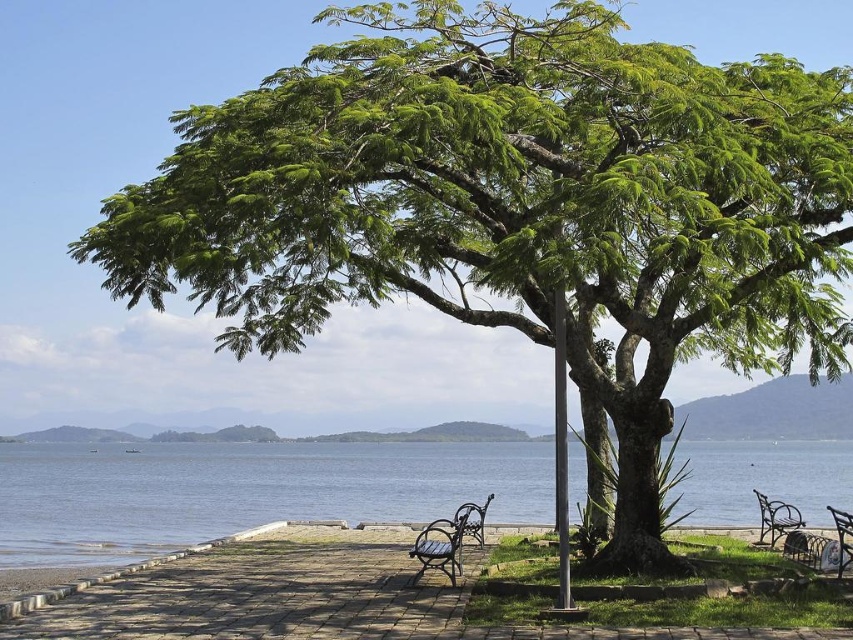
Is point (358, 492) farther from camera compared to point (461, 554)?

Yes.

Does blue water at lower center appear on the right side of bronze textured bench at center?

No, blue water at lower center is not to the right of bronze textured bench at center.

I want to click on blue water at lower center, so click(245, 492).

Find the location of a particular element. The width and height of the screenshot is (853, 640). blue water at lower center is located at coordinates (245, 492).

Between point (780, 516) and point (842, 513), which one is positioned in front?

Point (842, 513) is more forward.

The image size is (853, 640). Describe the element at coordinates (776, 518) in the screenshot. I see `brown wooden bench at lower right` at that location.

Locate an element on the screen. This screenshot has height=640, width=853. brown wooden bench at lower right is located at coordinates (776, 518).

Which is in front, point (200, 515) or point (764, 513)?

Point (764, 513) is more forward.

This screenshot has height=640, width=853. What are the coordinates of `blue water at lower center` in the screenshot? It's located at (245, 492).

Which is in front, point (364, 458) or point (769, 509)?

Point (769, 509) is more forward.

Locate an element on the screen. The image size is (853, 640). blue water at lower center is located at coordinates (245, 492).